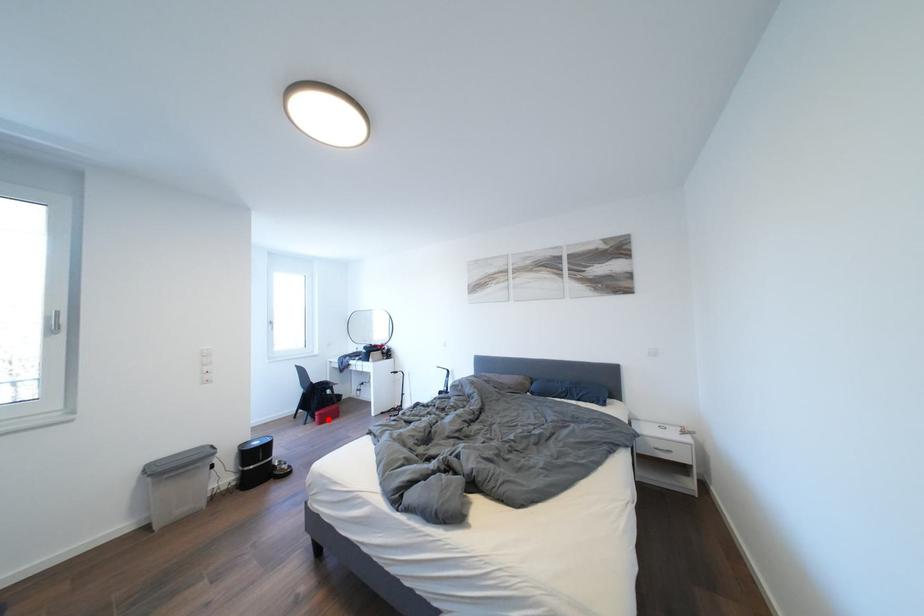
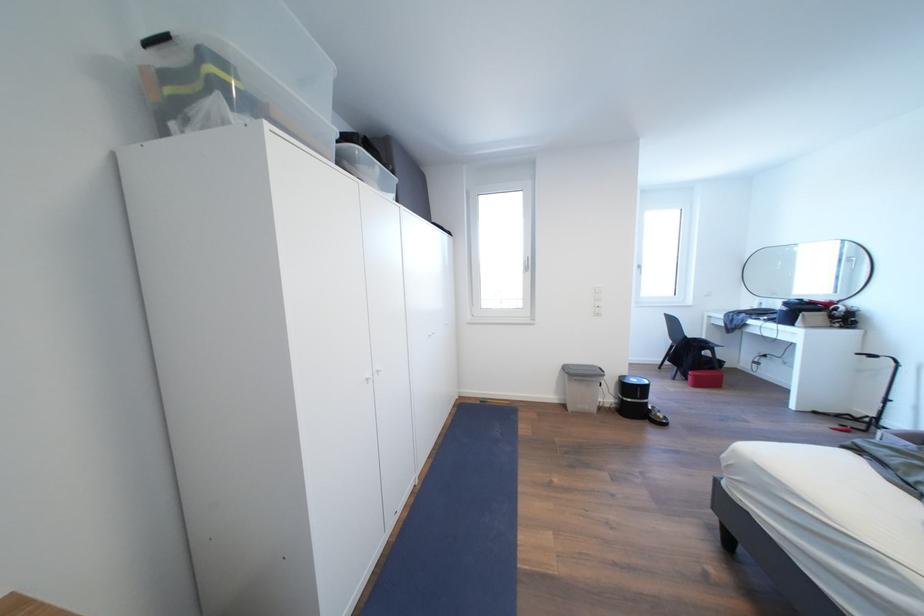
Question: I am providing you with two images of the same scene from different viewpoints. Image1 has a red point marked. In image2, the corresponding 3D location appears at what relative position? Reply with the corresponding letter.

Choices:
 (A) Closer
 (B) Farther

Answer: (B)